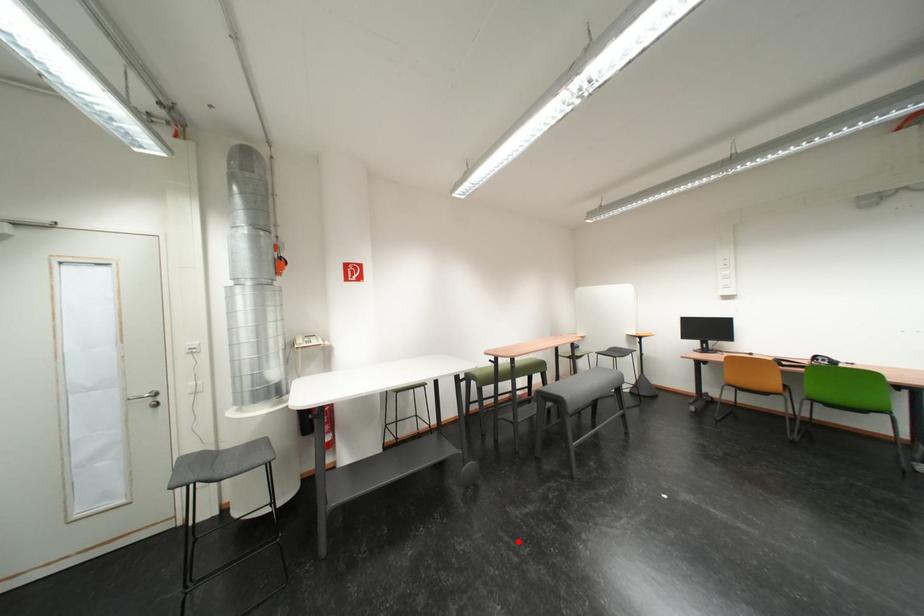
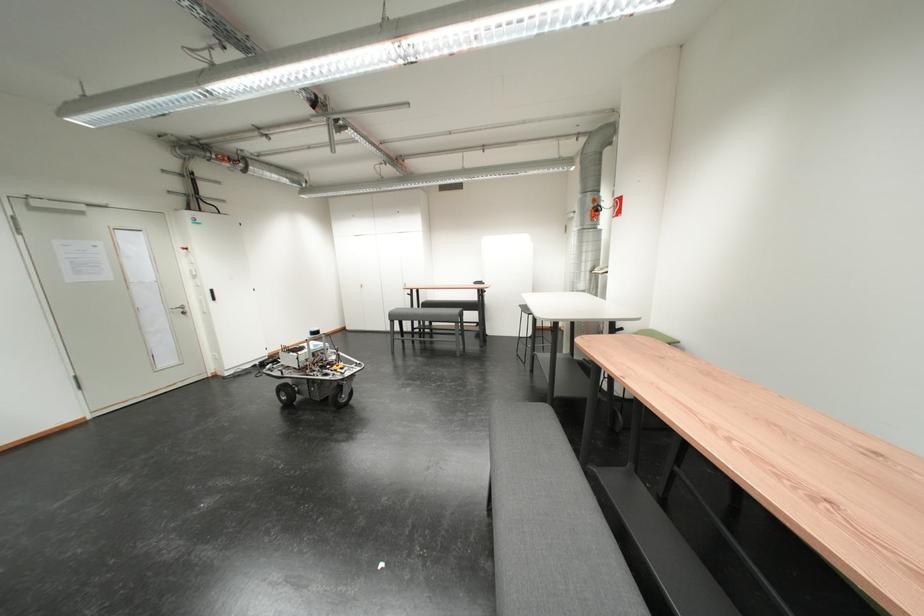
Question: I am providing you with two images of the same scene from different viewpoints. A red point is shown in image1. For the corresponding object point in image2, is it positioned nearer or farther from the camera?

Choices:
 (A) Nearer
 (B) Farther

Answer: (A)